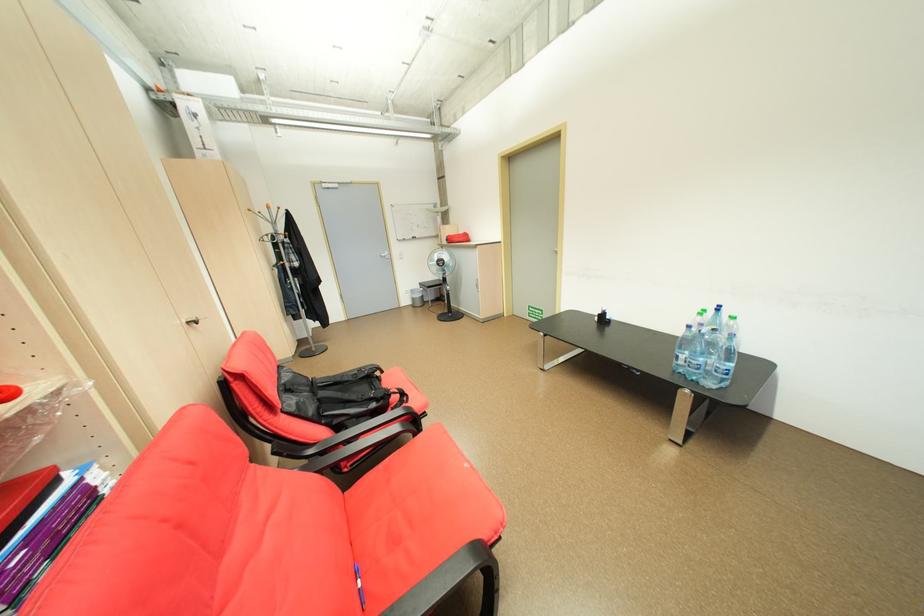
I want to click on grey door handle, so click(x=382, y=254).